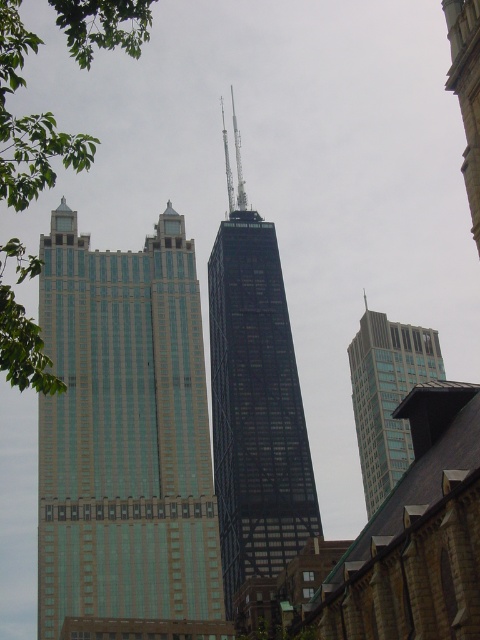
Which of these two, green leafy tree at left or glassy teal skyscraper at right, stands shorter?

Standing shorter between the two is glassy teal skyscraper at right.

Can you confirm if green leafy tree at left is taller than glassy teal skyscraper at right?

Yes, green leafy tree at left is taller than glassy teal skyscraper at right.

Where is `green leafy tree at left`? The height and width of the screenshot is (640, 480). green leafy tree at left is located at coordinates (29, 124).

Where is `glassy teal skyscraper at right`? glassy teal skyscraper at right is located at coordinates (386, 396).

Between point (357, 413) and point (475, 132), which one is positioned in front?

Point (475, 132) is in front.

The image size is (480, 640). I want to click on glassy teal skyscraper at right, so click(x=386, y=396).

Which is more to the right, green leafy tree at left or smooth stone spire at upper right?

smooth stone spire at upper right is more to the right.

Measure the distance between green leafy tree at left and smooth stone spire at upper right.

34.41 meters

Which is in front, point (133, 36) or point (477, 56)?

Point (133, 36)

Find the location of a particular element. The image size is (480, 640). green leafy tree at left is located at coordinates (29, 124).